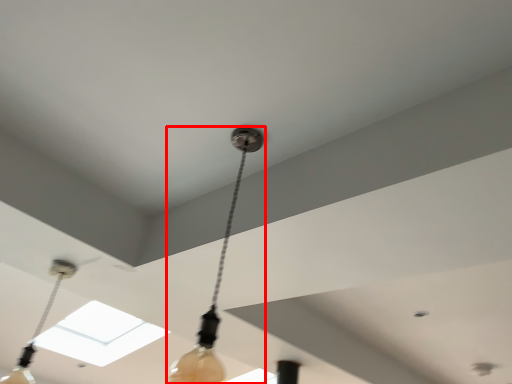
Question: From the image's perspective, considering the relative positions of lamp (annotated by the red box) and lamp in the image provided, where is lamp (annotated by the red box) located with respect to the staircase?

Choices:
 (A) above
 (B) below

Answer: (A)